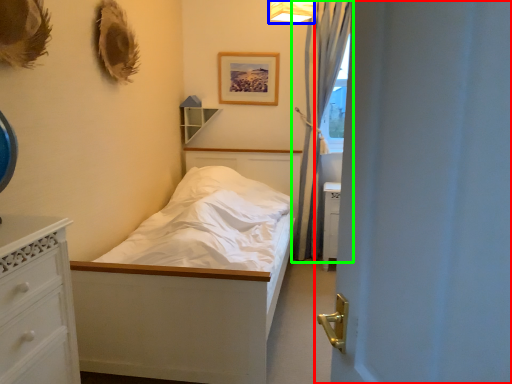
Question: Which object is positioned farthest from door (highlighted by a red box)? Select from light fixture (highlighted by a blue box) and curtain (highlighted by a green box).

Choices:
 (A) light fixture
 (B) curtain

Answer: (B)